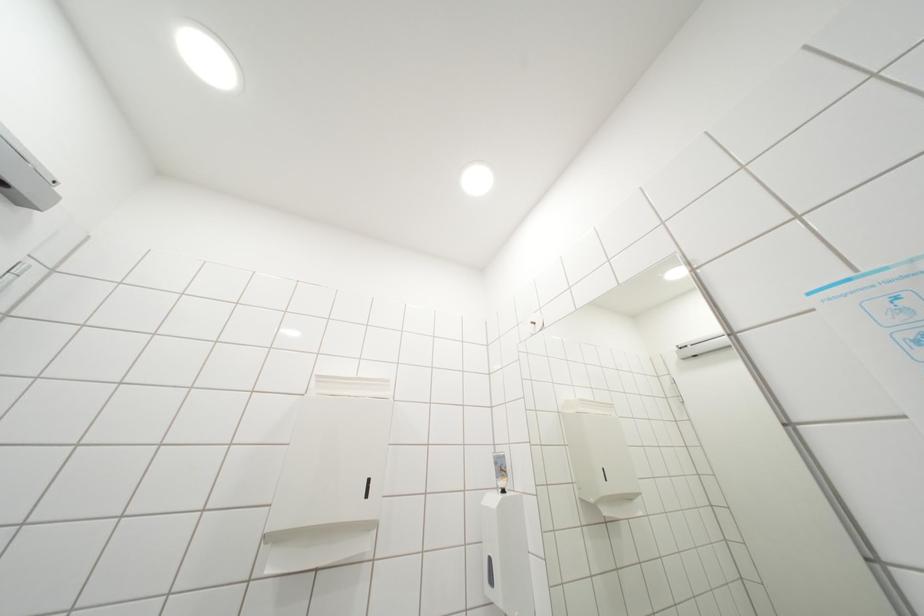
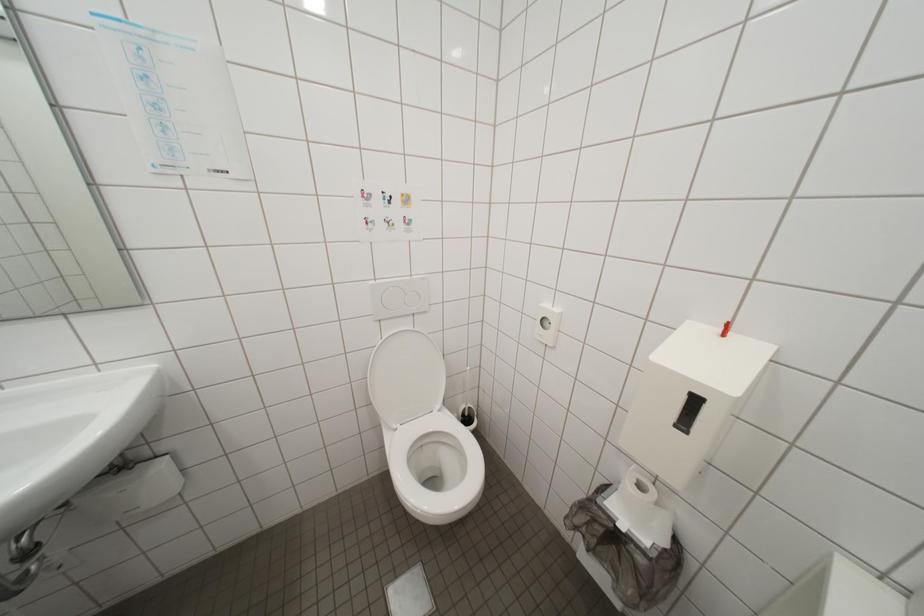
Question: The camera is either moving clockwise (left) or counter-clockwise (right) around the object. The first image is from the beginning of the video and the second image is from the end. Is the camera moving left or right when shooting the video?

Choices:
 (A) Left
 (B) Right

Answer: (A)